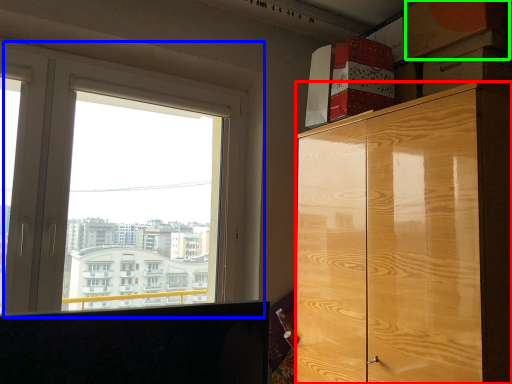
Question: Which object is the closest to the cabinetry (highlighted by a red box)? Choose among these: window (highlighted by a blue box) or cardboard box (highlighted by a green box).

Choices:
 (A) window
 (B) cardboard box

Answer: (B)